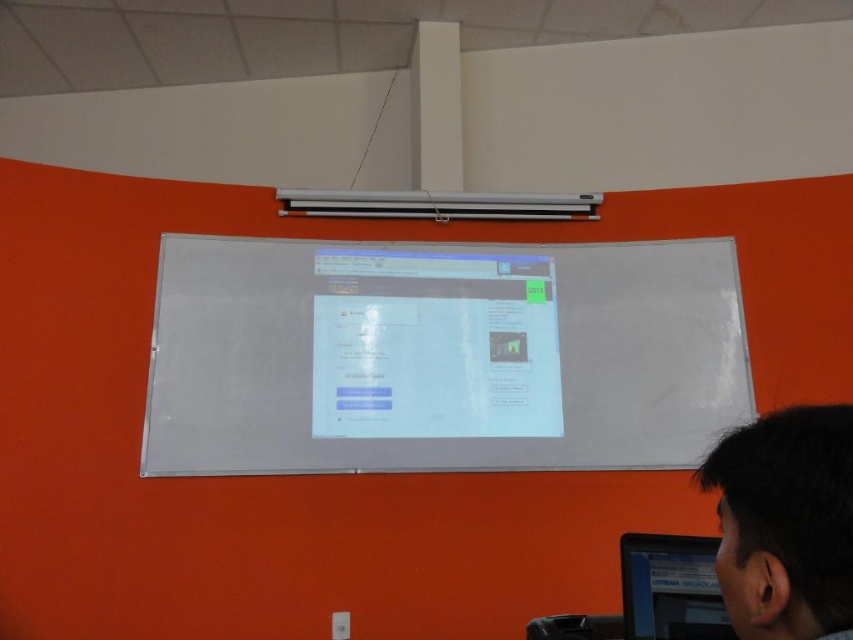
Question: Where is white matte board at center located in relation to black glossy monitor at lower right in the image?

Choices:
 (A) right
 (B) left

Answer: (B)

Question: Which object is farther from the camera taking this photo?

Choices:
 (A) black glossy monitor at lower right
 (B) white matte board at center

Answer: (B)

Question: Is white matte board at center positioned at the back of black glossy monitor at lower right?

Choices:
 (A) yes
 (B) no

Answer: (A)

Question: Which object is the closest to the dark hair at lower right?

Choices:
 (A) white matte board at center
 (B) black glossy monitor at lower right

Answer: (B)

Question: Where is dark hair at lower right located in relation to black glossy monitor at lower right in the image?

Choices:
 (A) below
 (B) above

Answer: (B)

Question: Which point is farther from the camera taking this photo?

Choices:
 (A) (635, 593)
 (B) (611, 448)

Answer: (B)